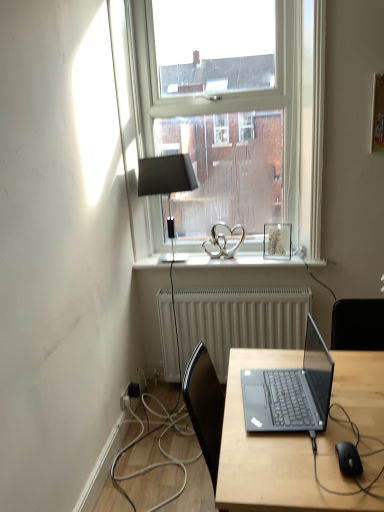
At what (x,y) coordinates should I click in order to perform the action: click on vacant area on top of matte black laptop at center (from a real-world perspective). Please return your answer as a coordinate pair (x, y). This screenshot has width=384, height=512. Looking at the image, I should click on 311,403.